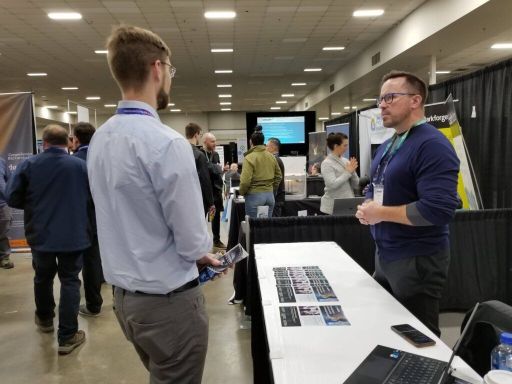
Identify the location of screen. (455, 343), (304, 140).